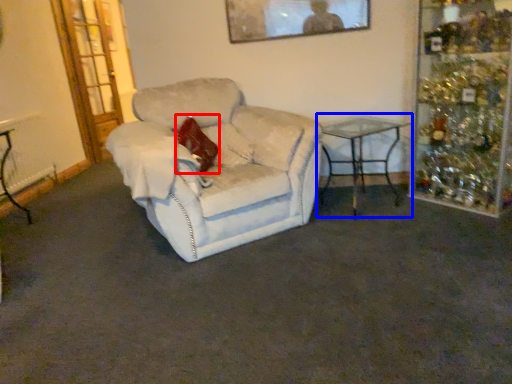
Question: Which point is further to the camera, pillow (highlighted by a red box) or table (highlighted by a blue box)?

Choices:
 (A) pillow
 (B) table

Answer: (A)